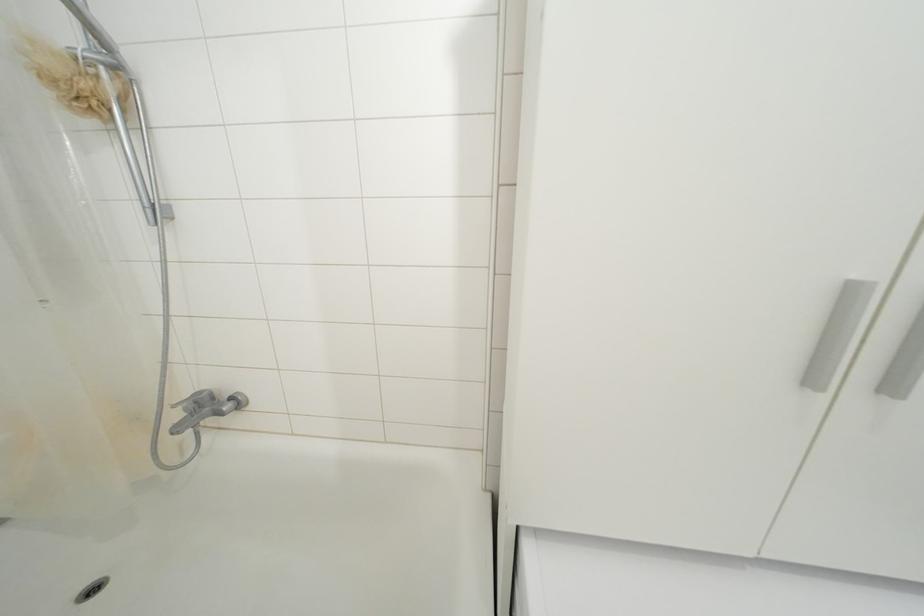
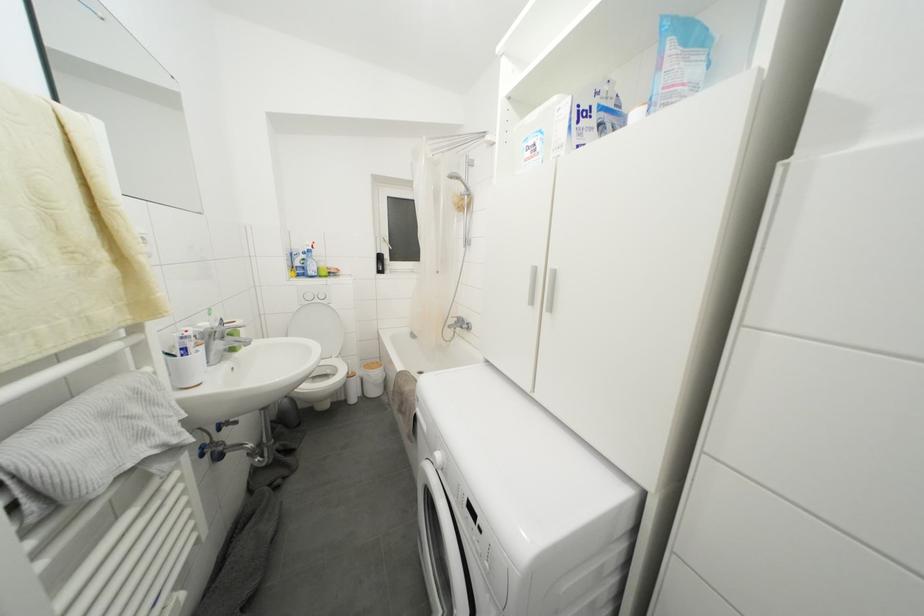
Question: The first image is from the beginning of the video and the second image is from the end. How did the camera likely rotate when shooting the video?

Choices:
 (A) Left
 (B) Right
 (C) Up
 (D) Down

Answer: (A)